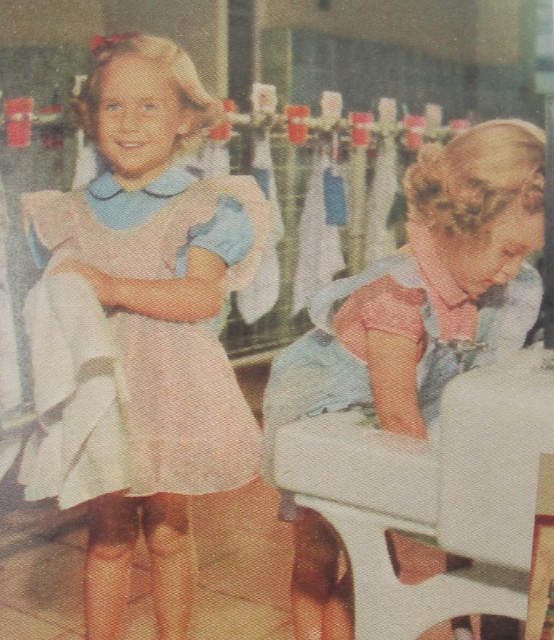
You are standing in front of the vintage classroom scene. There are two girls in the image. The girl on the left is wearing a light colored dress with a blue collar and the girl on the right is wearing a pink fabric dress at left. Which girl is closer to the camera?

The pink fabric dress at left is located at point (129, 403), which indicates its position in the image. Based on the coordinates, the girl wearing the pink fabric dress at left is closer to the camera compared to the other girl.